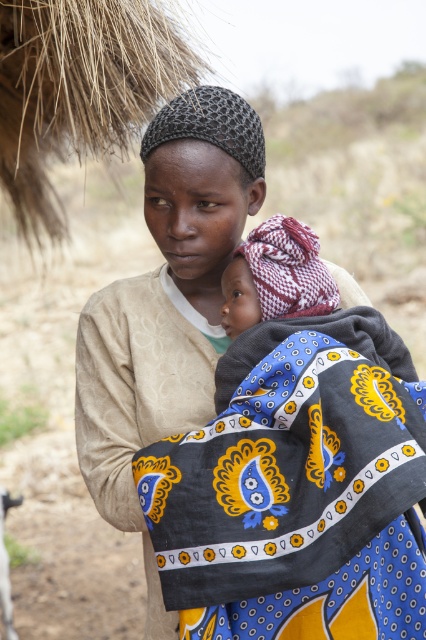
Locate an element on the screen. This screenshot has width=426, height=640. matte beige shirt at center is located at coordinates (166, 292).

Does matte beige shirt at center have a lesser width compared to patterned fabric baby at center?

No, matte beige shirt at center is not thinner than patterned fabric baby at center.

Who is more forward, (212, 621) or (321, 269)?

Point (212, 621)

The height and width of the screenshot is (640, 426). In order to click on matte beige shirt at center in this screenshot , I will do `click(166, 292)`.

Does point (284, 608) come in front of point (325, 417)?

No, it is behind (325, 417).

Can you confirm if matte beige shirt at center is shorter than dark blue fabric with yellow and white patterns at center?

No.

Who is more distant from viewer, (186, 186) or (348, 625)?

The point (186, 186) is more distant.

Identify the location of matte beige shirt at center. This screenshot has height=640, width=426. (166, 292).

Does dark blue fabric with yellow and white patterns at center have a smaller size compared to patterned fabric baby at center?

No.

Which is above, dark blue fabric with yellow and white patterns at center or patterned fabric baby at center?

patterned fabric baby at center

Identify the location of dark blue fabric with yellow and white patterns at center. (294, 502).